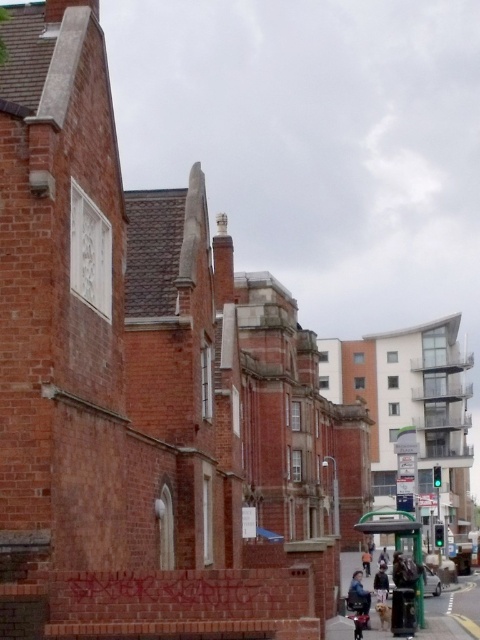
Question: Is blue denim jacket at lower right to the left of orange cotton shirt at center from the viewer's perspective?

Choices:
 (A) no
 (B) yes

Answer: (B)

Question: Does dark brown leather jacket at center come behind orange cotton shirt at center?

Choices:
 (A) yes
 (B) no

Answer: (B)

Question: Which point is closer to the camera taking this photo?

Choices:
 (A) (385, 552)
 (B) (380, 592)
 (C) (362, 568)
 (D) (364, 598)

Answer: (D)

Question: Which object is positioned closest to the dark brown leather jacket at center?

Choices:
 (A) dark blue jeans at center
 (B) shiny black motorcycle at lower right

Answer: (B)

Question: Is blue denim jacket at lower right wider than dark blue jeans at center?

Choices:
 (A) no
 (B) yes

Answer: (A)

Question: Which point is farther to the camera?

Choices:
 (A) (380, 566)
 (B) (363, 561)

Answer: (B)